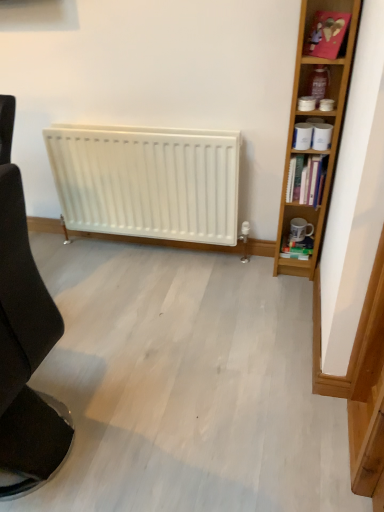
Question: Is matte plastic container at upper right bigger or smaller than light brown wood bookcase at right?

Choices:
 (A) small
 (B) big

Answer: (A)

Question: From the image's perspective, is matte plastic container at upper right located above or below light brown wood bookcase at right?

Choices:
 (A) below
 (B) above

Answer: (B)

Question: Based on their relative distances, which object is farther from the pink cardboard at upper right?

Choices:
 (A) matte plastic container at upper right
 (B) hardcover books at right
 (C) white glossy mug at right
 (D) light brown wood bookcase at right
 (E) black fabric chair at left

Answer: (E)

Question: Which object is the closest to the black fabric chair at left?

Choices:
 (A) hardcover books at right
 (B) light brown wood bookcase at right
 (C) matte plastic container at upper right
 (D) white glossy mug at right
 (E) pink cardboard at upper right

Answer: (A)